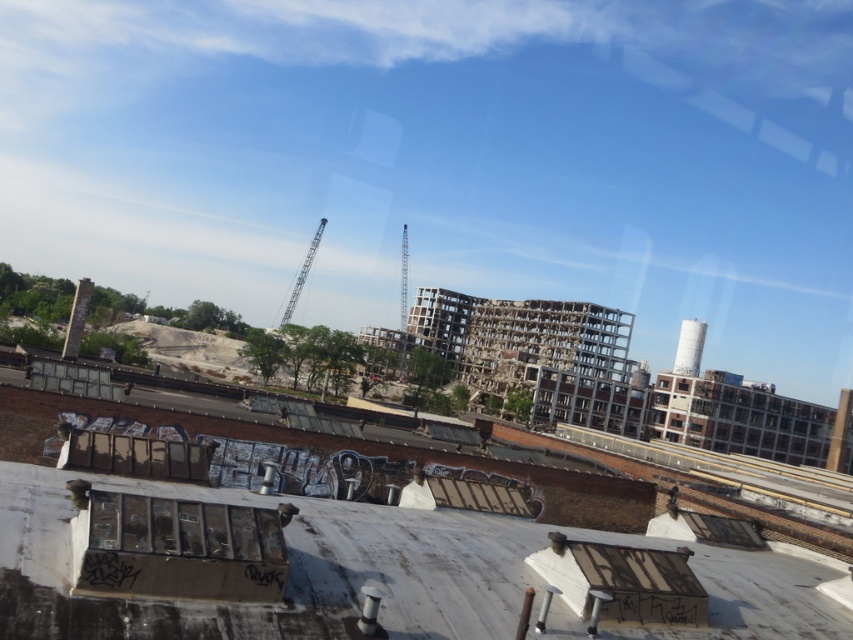
Question: Does exposed concrete rubble at center lie in front of metallic gray crane at center?

Choices:
 (A) no
 (B) yes

Answer: (B)

Question: Which point is closer to the camera taking this photo?

Choices:
 (A) (216, 509)
 (B) (494, 600)
 (C) (320, 237)

Answer: (A)

Question: Is exposed concrete rubble at center closer to the viewer compared to metallic glass train window at lower left?

Choices:
 (A) yes
 (B) no

Answer: (A)

Question: Which object is closer to the camera taking this photo?

Choices:
 (A) exposed concrete rubble at center
 (B) metallic glass train window at lower left

Answer: (A)

Question: Does metallic glass train window at lower left appear over metallic gray crane at center?

Choices:
 (A) no
 (B) yes

Answer: (A)

Question: Which of the following is the closest to the observer?

Choices:
 (A) (300, 269)
 (B) (132, 620)

Answer: (B)